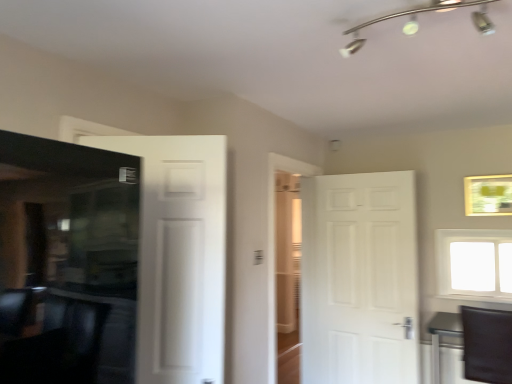
Question: Considering the relative sizes of white matte door at left, marked as the second door in a right-to-left arrangement, and black leather swivel chair at lower right in the image provided, is white matte door at left, marked as the second door in a right-to-left arrangement, thinner than black leather swivel chair at lower right?

Choices:
 (A) yes
 (B) no

Answer: (A)

Question: From the image's perspective, is white matte door at left, acting as the second door starting from the back, located above black leather swivel chair at lower right?

Choices:
 (A) no
 (B) yes

Answer: (B)

Question: Is white matte door at left, acting as the 1th door starting from the left, with black leather swivel chair at lower right?

Choices:
 (A) yes
 (B) no

Answer: (B)

Question: Is white matte door at left, marked as the second door in a right-to-left arrangement, smaller than black leather swivel chair at lower right?

Choices:
 (A) no
 (B) yes

Answer: (B)

Question: Would you say white matte door at left, the 1th door positioned from the front, is outside black leather swivel chair at lower right?

Choices:
 (A) yes
 (B) no

Answer: (A)

Question: Which is correct: green matte picture frame at upper right is inside white matte door at left, marked as the second door in a right-to-left arrangement, or outside of it?

Choices:
 (A) outside
 (B) inside

Answer: (A)

Question: From their relative heights in the image, would you say green matte picture frame at upper right is taller or shorter than white matte door at left, acting as the second door starting from the back?

Choices:
 (A) short
 (B) tall

Answer: (A)

Question: From the image's perspective, is green matte picture frame at upper right above or below white matte door at left, acting as the second door starting from the back?

Choices:
 (A) below
 (B) above

Answer: (B)

Question: From a real-world perspective, is green matte picture frame at upper right physically located above or below white matte door at left, acting as the 1th door starting from the left?

Choices:
 (A) above
 (B) below

Answer: (A)

Question: In the image, is silver metallic track lighting at upper center positioned in front of or behind white matte door at left, acting as the 1th door starting from the left?

Choices:
 (A) behind
 (B) front

Answer: (B)

Question: Is point (486, 21) closer or farther from the camera than point (156, 329)?

Choices:
 (A) farther
 (B) closer

Answer: (B)

Question: From a real-world perspective, is silver metallic track lighting at upper center positioned above or below white matte door at left, marked as the second door in a right-to-left arrangement?

Choices:
 (A) above
 (B) below

Answer: (A)

Question: Is silver metallic track lighting at upper center inside or outside of white matte door at left, the 1th door positioned from the front?

Choices:
 (A) inside
 (B) outside

Answer: (B)

Question: Relative to green matte picture frame at upper right, is black leather swivel chair at lower right in front or behind?

Choices:
 (A) front
 (B) behind

Answer: (A)

Question: Considering the positions of black leather swivel chair at lower right and green matte picture frame at upper right in the image, is black leather swivel chair at lower right taller or shorter than green matte picture frame at upper right?

Choices:
 (A) tall
 (B) short

Answer: (A)